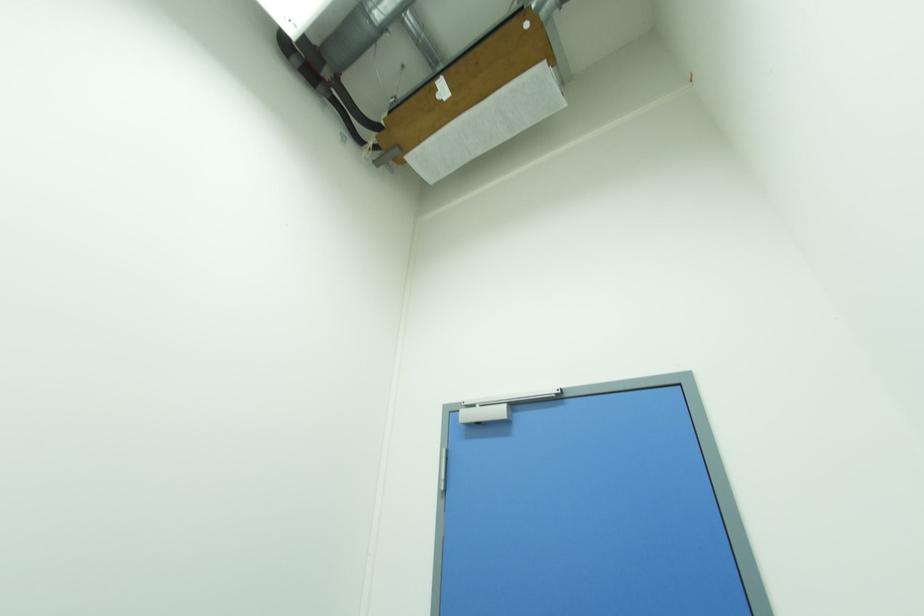
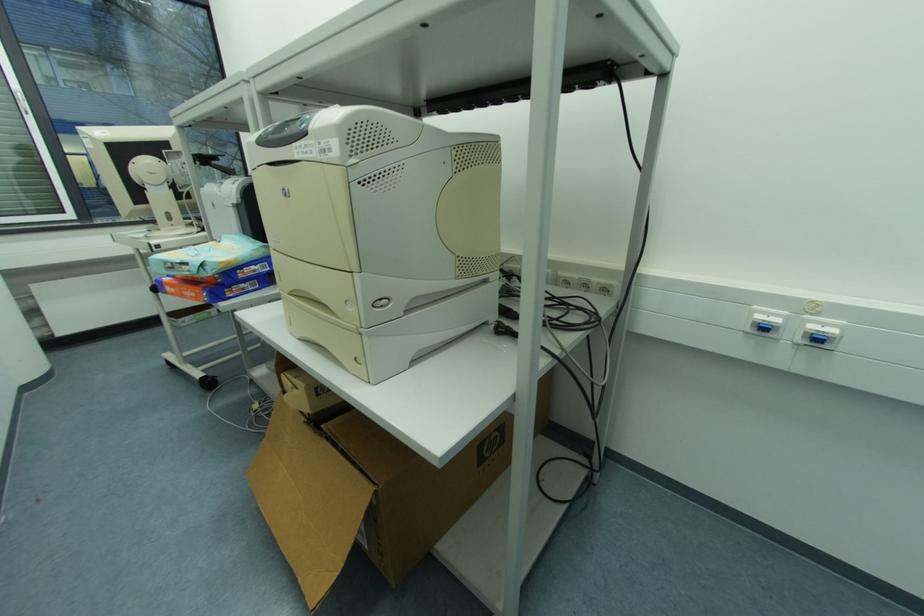
Question: The camera is either moving clockwise (left) or counter-clockwise (right) around the object. The first image is from the beginning of the video and the second image is from the end. Is the camera moving left or right when shooting the video?

Choices:
 (A) Left
 (B) Right

Answer: (B)